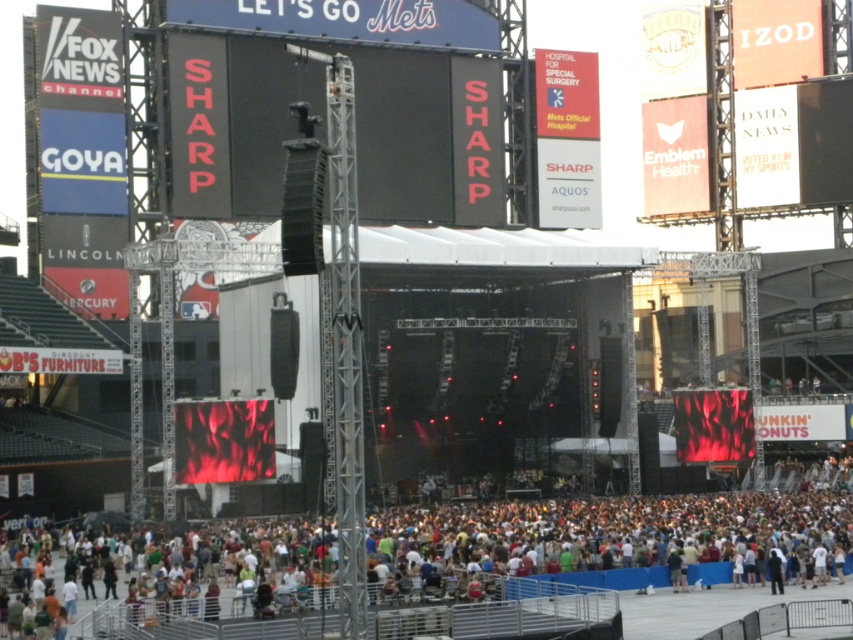
Is multicolored fabric crowd at lower center in front of black matte scoreboard at center?

Yes.

Which of these two, multicolored fabric crowd at lower center or black matte scoreboard at center, stands taller?

Standing taller between the two is black matte scoreboard at center.

Identify the location of multicolored fabric crowd at lower center. (590, 560).

Locate an element on the screen. The width and height of the screenshot is (853, 640). multicolored fabric crowd at lower center is located at coordinates (590, 560).